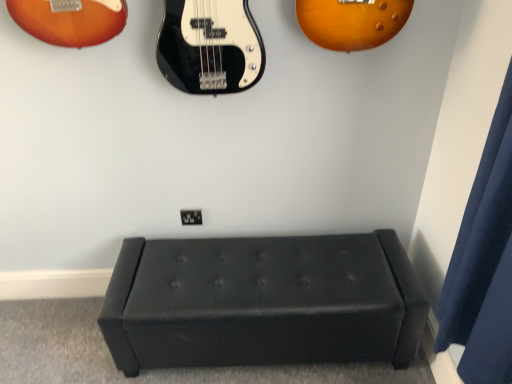
Question: From a real-world perspective, is black leather ottoman at center on dark blue fabric curtain at right?

Choices:
 (A) no
 (B) yes

Answer: (A)

Question: Is black leather ottoman at center smaller than dark blue fabric curtain at right?

Choices:
 (A) no
 (B) yes

Answer: (A)

Question: Does black leather ottoman at center appear on the right side of dark blue fabric curtain at right?

Choices:
 (A) no
 (B) yes

Answer: (A)

Question: Would you consider black leather ottoman at center to be distant from dark blue fabric curtain at right?

Choices:
 (A) yes
 (B) no

Answer: (B)

Question: Is the surface of black leather ottoman at center in direct contact with dark blue fabric curtain at right?

Choices:
 (A) yes
 (B) no

Answer: (B)

Question: Can you confirm if black leather ottoman at center is wider than dark blue fabric curtain at right?

Choices:
 (A) no
 (B) yes

Answer: (B)

Question: From the image's perspective, is dark blue fabric curtain at right beneath black leather ottoman at center?

Choices:
 (A) no
 (B) yes

Answer: (A)

Question: Does dark blue fabric curtain at right contain black leather ottoman at center?

Choices:
 (A) yes
 (B) no

Answer: (B)

Question: Is dark blue fabric curtain at right to the left of black leather ottoman at center from the viewer's perspective?

Choices:
 (A) no
 (B) yes

Answer: (A)

Question: Is dark blue fabric curtain at right located outside black leather ottoman at center?

Choices:
 (A) no
 (B) yes

Answer: (B)

Question: Does dark blue fabric curtain at right turn towards black leather ottoman at center?

Choices:
 (A) yes
 (B) no

Answer: (B)

Question: Are dark blue fabric curtain at right and black leather ottoman at center located far from each other?

Choices:
 (A) no
 (B) yes

Answer: (A)

Question: Is black leather ottoman at center inside the boundaries of dark blue fabric curtain at right, or outside?

Choices:
 (A) outside
 (B) inside

Answer: (A)